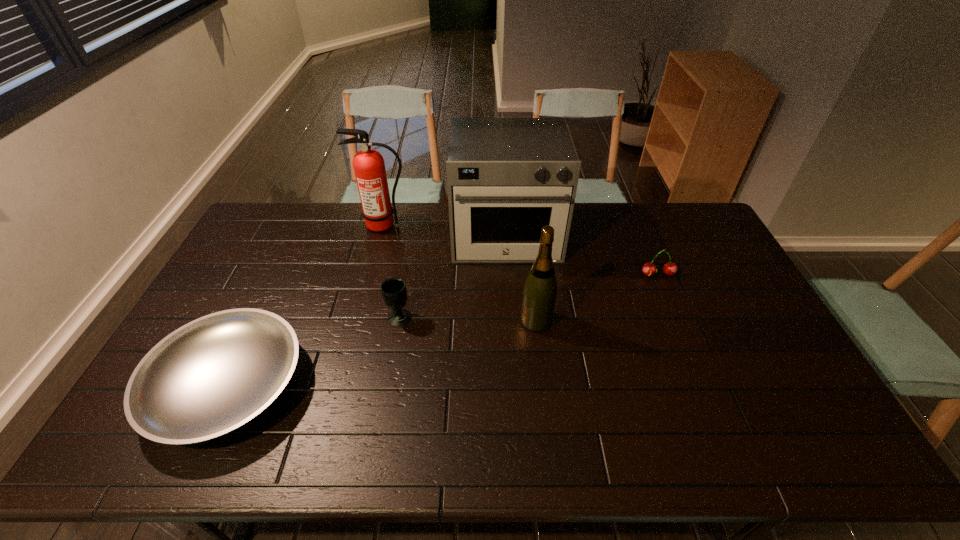
Where is `object that is at the near left corner`? The height and width of the screenshot is (540, 960). object that is at the near left corner is located at coordinates (213, 375).

You are a GUI agent. You are given a task and a screenshot of the screen. Output one action in this format:
    pyautogui.click(x=<x>, y=<y>)
    Task: Click on the free region at the far edge of the desktop
    
    Given the screenshot: What is the action you would take?
    pyautogui.click(x=314, y=206)

Locate an element on the screen. The height and width of the screenshot is (540, 960). free region at the near edge of the desktop is located at coordinates (411, 461).

The height and width of the screenshot is (540, 960). Identify the location of free space at the left edge of the desktop. (237, 303).

Where is `vacant region at the right edge`? This screenshot has width=960, height=540. vacant region at the right edge is located at coordinates (685, 254).

At what (x,y) coordinates should I click in order to perform the action: click on vacant position at the far left corner of the desktop. Please return your answer as a coordinate pair (x, y). The image size is (960, 540). Looking at the image, I should click on (282, 220).

Image resolution: width=960 pixels, height=540 pixels. I want to click on vacant space that is in between the toaster oven and the wine bottle, so pyautogui.click(x=521, y=278).

Identify the location of vacant area that lies between the wine bottle and the leftmost object. The width and height of the screenshot is (960, 540). (382, 353).

Identify the location of free space between the fire extinguisher and the wine bottle. (460, 273).

At what (x,y) coordinates should I click in order to perform the action: click on free space between the shortest object and the fourth nearest object. Please return your answer as a coordinate pair (x, y). The height and width of the screenshot is (540, 960). Looking at the image, I should click on (443, 330).